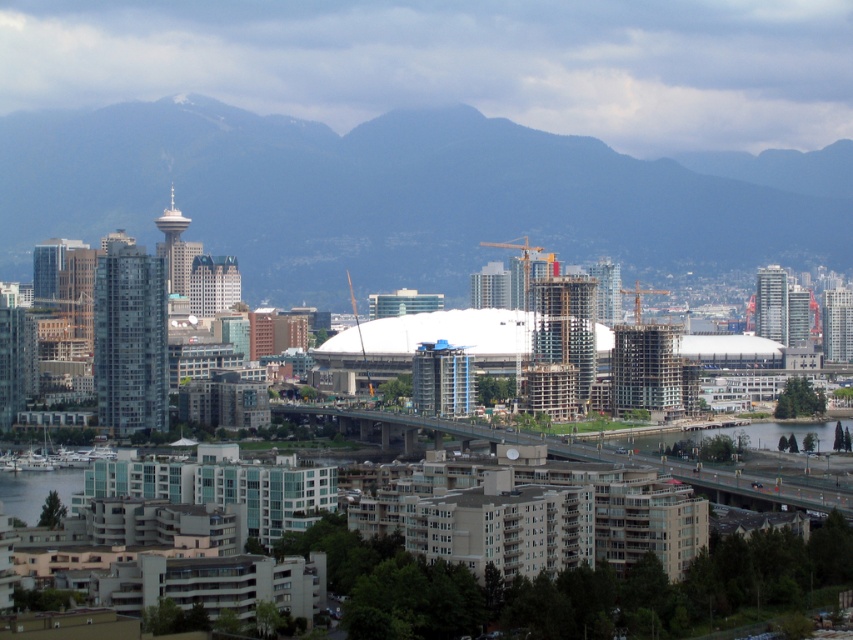
You are standing at the center of the city and looking at two points in the scene. The first point is located at coordinates point (x=248, y=268) and the second point is at point (x=585, y=433). Which point is closer to you?

Point (x=248, y=268) is closer to you because it is further to the viewer than point (x=585, y=433).